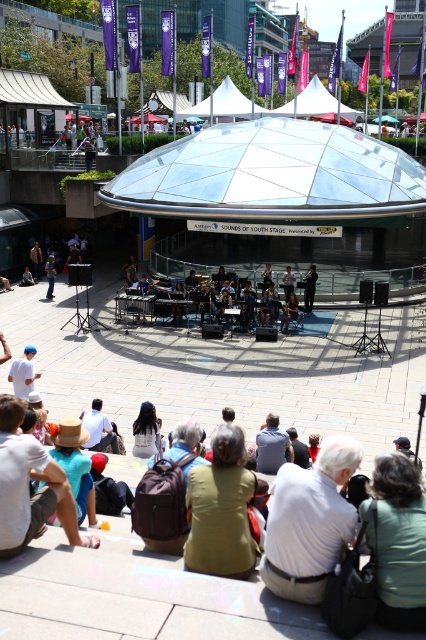
Looking at this image, you are a photographer at the event and want to capture both the transparent glass dome at center and the green fabric jacket at lower center in a single frame. Considering their sizes, which object should you focus on to ensure both are visible without cropping?

The transparent glass dome at center is bigger than the green fabric jacket at lower center. To include both in the frame, focus on the transparent glass dome at center since it occupies more space, allowing the smaller green fabric jacket at lower center to fit alongside.

You are a photographer at the event and want to capture a photo of both the green fabric jacket at lower center and the dark blue shirt at center. Which person should you focus on first to ensure both are in the frame?

You should focus on the dark blue shirt at center first because the green fabric jacket at lower center is to the left of it, so by centering the dark blue shirt, the green jacket will naturally be included to the left side of the frame.

Consider the image. You are an attendee at the festival and want to take a photo of the white cotton shirt at lower center without the transparent glass dome at center appearing in the shot. How should you position yourself?

Move to the left side of the white cotton shirt at lower center so that the transparent glass dome at center is out of the frame to the right.